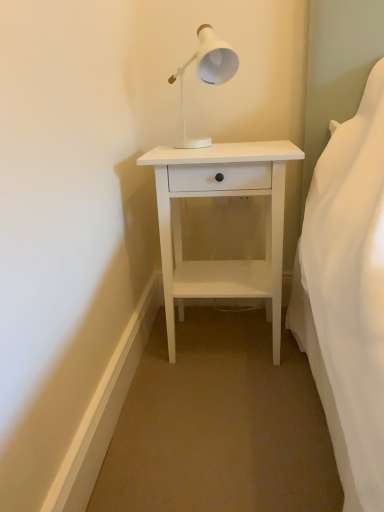
What are the coordinates of `white matte lamp at upper center` in the screenshot? It's located at (206, 75).

The image size is (384, 512). Describe the element at coordinates (206, 75) in the screenshot. I see `white matte lamp at upper center` at that location.

Measure the distance between point (199, 266) and camera.

They are 1.55 meters apart.

You are a GUI agent. You are given a task and a screenshot of the screen. Output one action in this format:
    pyautogui.click(x=<x>, y=<y>)
    Task: Click on the white matte nightstand at center
    
    Given the screenshot: What is the action you would take?
    coord(221,196)

What is the approximate height of white matte nightstand at center?

It is 27.20 inches.

The width and height of the screenshot is (384, 512). What do you see at coordinates (221, 196) in the screenshot?
I see `white matte nightstand at center` at bounding box center [221, 196].

Where is `white matte lamp at upper center`? white matte lamp at upper center is located at coordinates (206, 75).

Is white matte nightstand at center at the left side of white matte lamp at upper center?

In fact, white matte nightstand at center is to the right of white matte lamp at upper center.

Is the position of white matte nightstand at center less distant than that of white matte lamp at upper center?

No.

Is point (160, 184) positioned in front of point (204, 47)?

No, (160, 184) is behind (204, 47).

From the image's perspective, is white matte nightstand at center above or below white matte lamp at upper center?

Clearly, from the image's perspective, white matte nightstand at center is below white matte lamp at upper center.

From a real-world perspective, which object stands above the other?

white matte lamp at upper center is physically above.

Considering the relative sizes of white matte nightstand at center and white matte lamp at upper center in the image provided, is white matte nightstand at center wider than white matte lamp at upper center?

Yes, white matte nightstand at center is wider than white matte lamp at upper center.

Can you confirm if white matte nightstand at center is taller than white matte lamp at upper center?

Indeed, white matte nightstand at center has a greater height compared to white matte lamp at upper center.

Does white matte nightstand at center have a smaller size compared to white matte lamp at upper center?

No.

Is white matte nightstand at center located outside white matte lamp at upper center?

Yes, white matte nightstand at center is located beyond the bounds of white matte lamp at upper center.

Is white matte nightstand at center in contact with white matte lamp at upper center?

white matte nightstand at center is not next to white matte lamp at upper center, and they're not touching.

Looking at this image, is white matte nightstand at center oriented away from white matte lamp at upper center?

No, white matte nightstand at center is not facing the opposite direction of white matte lamp at upper center.

How different are the orientations of white matte nightstand at center and white matte lamp at upper center in degrees?

white matte nightstand at center and white matte lamp at upper center are facing 0.00071 degrees away from each other.

Measure the distance between white matte nightstand at center and white matte lamp at upper center.

white matte nightstand at center and white matte lamp at upper center are 12.19 inches apart from each other.

The height and width of the screenshot is (512, 384). I want to click on lamp on the left side of white matte nightstand at center, so click(x=206, y=75).

Does white matte lamp at upper center appear on the left side of white matte nightstand at center?

Correct, you'll find white matte lamp at upper center to the left of white matte nightstand at center.

Is white matte lamp at upper center in front of white matte nightstand at center?

Yes.

Considering the positions of point (229, 72) and point (168, 301), is point (229, 72) closer or farther from the camera than point (168, 301)?

Point (229, 72) is positioned closer to the camera compared to point (168, 301).

From the image's perspective, relative to white matte nightstand at center, is white matte lamp at upper center above or below?

white matte lamp at upper center is situated higher than white matte nightstand at center in the image.

From a real-world perspective, is white matte lamp at upper center positioned above or below white matte nightstand at center?

white matte lamp at upper center is above white matte nightstand at center.

In terms of width, does white matte lamp at upper center look wider or thinner when compared to white matte nightstand at center?

Considering their sizes, white matte lamp at upper center looks slimmer than white matte nightstand at center.

Who is shorter, white matte lamp at upper center or white matte nightstand at center?

With less height is white matte lamp at upper center.

Between white matte lamp at upper center and white matte nightstand at center, which one has smaller size?

With smaller size is white matte lamp at upper center.

Is white matte lamp at upper center inside or outside of white matte nightstand at center?

white matte lamp at upper center is not enclosed by white matte nightstand at center.

Is white matte lamp at upper center directly adjacent to white matte nightstand at center?

There is a gap between white matte lamp at upper center and white matte nightstand at center.

Is white matte lamp at upper center facing away from white matte nightstand at center?

white matte lamp at upper center does not have its back to white matte nightstand at center.

Can you tell me how much white matte lamp at upper center and white matte nightstand at center differ in facing direction?

They differ by 0.00071 degrees in their facing directions.

How much distance is there between white matte lamp at upper center and white matte nightstand at center?

white matte lamp at upper center is 12.19 inches from white matte nightstand at center.

You are a GUI agent. You are given a task and a screenshot of the screen. Output one action in this format:
    pyautogui.click(x=<x>, y=<y>)
    Task: Click on the lamp above the white matte nightstand at center (from a real-world perspective)
    
    Given the screenshot: What is the action you would take?
    pyautogui.click(x=206, y=75)

In order to click on nightstand located below the white matte lamp at upper center (from the image's perspective) in this screenshot , I will do `click(221, 196)`.

In order to click on lamp on the left of white matte nightstand at center in this screenshot , I will do `click(206, 75)`.